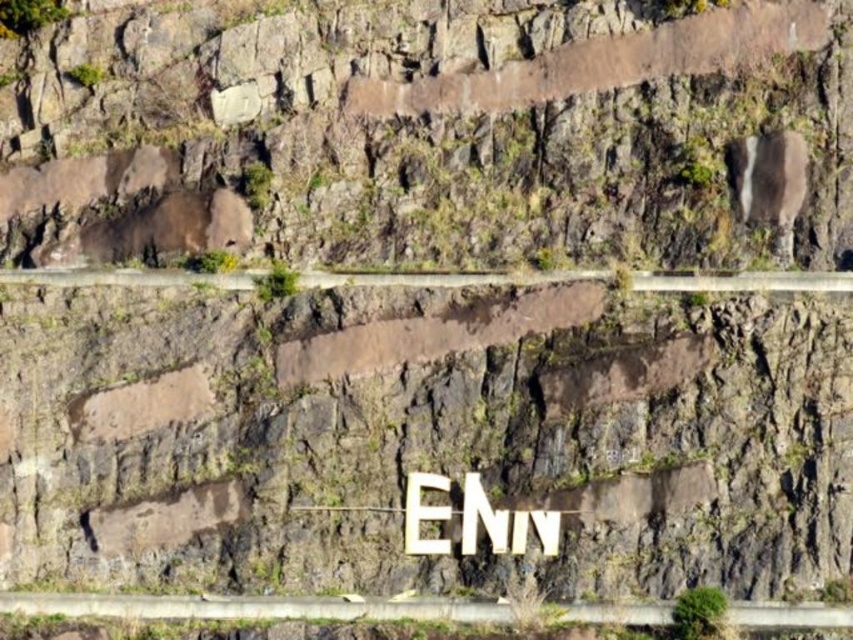
Question: Can you confirm if brown rock at center is positioned to the left of white wooden sign at center?

Choices:
 (A) no
 (B) yes

Answer: (B)

Question: Considering the real-world distances, which object is closest to the brown rock at center?

Choices:
 (A) white wooden sign at center
 (B) gray concrete path at lower center

Answer: (A)

Question: Which of the following is the farthest from the observer?

Choices:
 (A) white wooden sign at center
 (B) gray concrete path at lower center

Answer: (A)

Question: Is brown rock at center closer to camera compared to white wooden sign at center?

Choices:
 (A) yes
 (B) no

Answer: (B)

Question: Estimate the real-world distances between objects in this image. Which object is closer to the brown rock at center?

Choices:
 (A) white wooden sign at center
 (B) gray concrete path at lower center

Answer: (A)

Question: Is brown rock at center wider than white wooden sign at center?

Choices:
 (A) no
 (B) yes

Answer: (B)